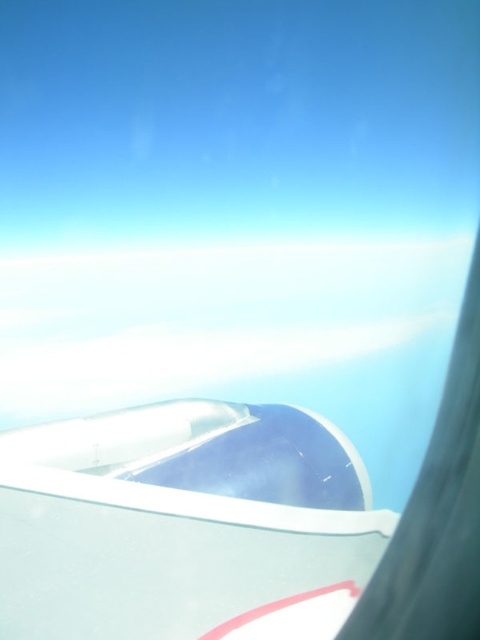
Does white glossy airplane wing at upper center appear over white fluffy cloud at upper center?

No, white glossy airplane wing at upper center is not above white fluffy cloud at upper center.

Is point (286, 609) behind point (59, 406)?

No, (286, 609) is in front of (59, 406).

Locate an element on the screen. white glossy airplane wing at upper center is located at coordinates (184, 525).